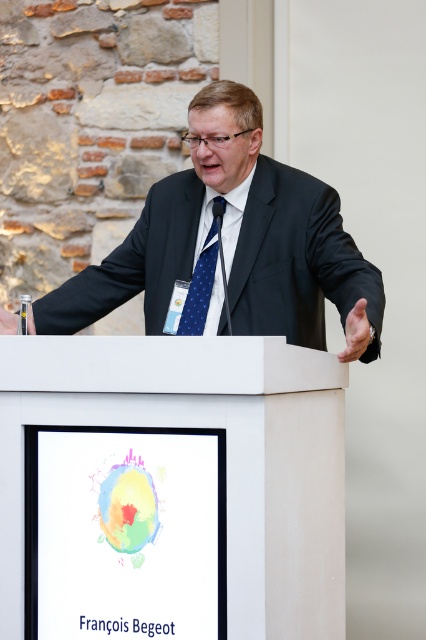
Who is shorter, black suit at center or blue dotted fabric tie at center?

Standing shorter between the two is blue dotted fabric tie at center.

Between black suit at center and blue dotted fabric tie at center, which one appears on the right side from the viewer's perspective?

From the viewer's perspective, black suit at center appears more on the right side.

Which is behind, point (238, 138) or point (203, 314)?

Positioned behind is point (203, 314).

Where is `black suit at center`? This screenshot has width=426, height=640. black suit at center is located at coordinates (233, 244).

Between point (157, 458) and point (207, 304), which one is positioned in front?

Positioned in front is point (157, 458).

Does white matte podium at center have a greater width compared to blue dotted fabric tie at center?

Yes.

Which is behind, point (111, 483) or point (206, 285)?

Point (206, 285)

Image resolution: width=426 pixels, height=640 pixels. Find the location of `white matte podium at center`. white matte podium at center is located at coordinates (170, 488).

Which is more to the right, white matte podium at center or black suit at center?

black suit at center

Who is more distant from viewer, (49, 369) or (83, 291)?

The point (83, 291) is more distant.

This screenshot has height=640, width=426. I want to click on white matte podium at center, so click(x=170, y=488).